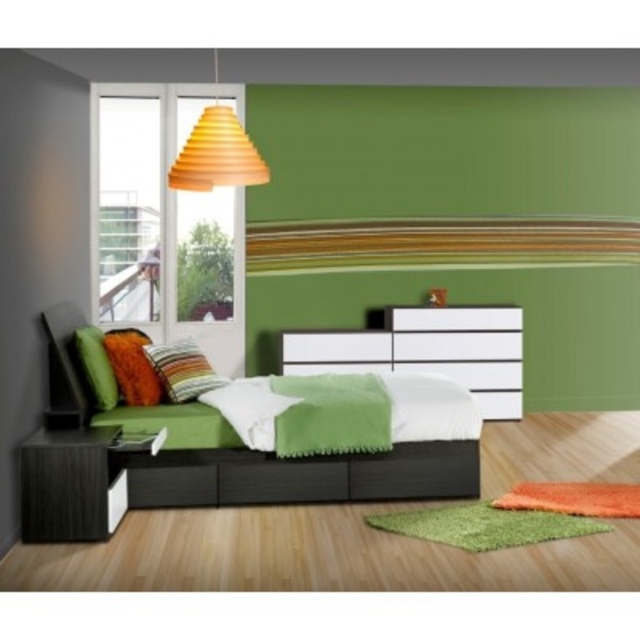
Does orange matte cone at upper center come behind green fabric pillow at left?

No, it is not.

Is point (211, 116) less distant than point (77, 332)?

Yes, it is.

Locate an element on the screen. This screenshot has width=640, height=640. orange matte cone at upper center is located at coordinates (216, 150).

Between matte black bed at center and green fabric pillow at left, which one appears on the left side from the viewer's perspective?

Positioned to the left is green fabric pillow at left.

Does matte black bed at center appear on the left side of green fabric pillow at left?

In fact, matte black bed at center is to the right of green fabric pillow at left.

Locate an element on the screen. matte black bed at center is located at coordinates (195, 465).

Locate an element on the screen. The width and height of the screenshot is (640, 640). matte black bed at center is located at coordinates (195, 465).

Which is behind, point (445, 339) or point (147, 384)?

Point (445, 339)

Does white glossy dresser at center appear under velvet orange pillow at center?

Indeed, white glossy dresser at center is positioned under velvet orange pillow at center.

Where is `white glossy dresser at center`? Image resolution: width=640 pixels, height=640 pixels. white glossy dresser at center is located at coordinates (428, 349).

Where is `white glossy dresser at center`? Image resolution: width=640 pixels, height=640 pixels. white glossy dresser at center is located at coordinates (428, 349).